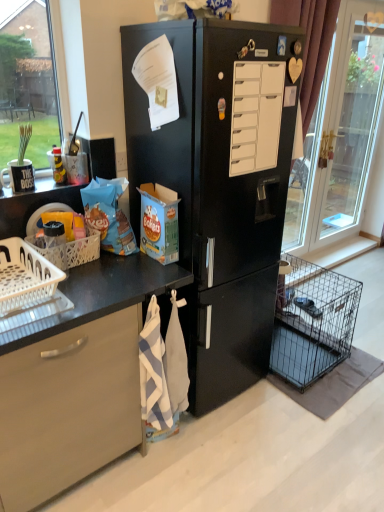
Question: Is black wire dog crate at lower right looking in the opposite direction of white striped towel at lower center?

Choices:
 (A) yes
 (B) no

Answer: (B)

Question: Is the position of black wire dog crate at lower right less distant than that of white striped towel at lower center?

Choices:
 (A) no
 (B) yes

Answer: (A)

Question: From the image's perspective, is black wire dog crate at lower right located beneath white striped towel at lower center?

Choices:
 (A) yes
 (B) no

Answer: (B)

Question: From a real-world perspective, is black wire dog crate at lower right positioned over white striped towel at lower center based on gravity?

Choices:
 (A) yes
 (B) no

Answer: (B)

Question: Does black wire dog crate at lower right come behind white striped towel at lower center?

Choices:
 (A) yes
 (B) no

Answer: (A)

Question: Is white matte drawer at center wider or thinner than black wire dog crate at lower right?

Choices:
 (A) wide
 (B) thin

Answer: (B)

Question: From a real-world perspective, is white matte drawer at center positioned above or below black wire dog crate at lower right?

Choices:
 (A) below
 (B) above

Answer: (B)

Question: From their relative heights in the image, would you say white matte drawer at center is taller or shorter than black wire dog crate at lower right?

Choices:
 (A) short
 (B) tall

Answer: (A)

Question: Is white matte drawer at center spatially inside black wire dog crate at lower right, or outside of it?

Choices:
 (A) inside
 (B) outside

Answer: (B)

Question: Is white plastic basket at left, which is counted as the 1th basket, starting from the front, spatially inside black wire dog crate at lower right, or outside of it?

Choices:
 (A) inside
 (B) outside

Answer: (B)

Question: Is point (16, 238) closer or farther from the camera than point (286, 289)?

Choices:
 (A) closer
 (B) farther

Answer: (A)

Question: From their relative heights in the image, would you say white plastic basket at left, the 2th basket when ordered from back to front, is taller or shorter than black wire dog crate at lower right?

Choices:
 (A) tall
 (B) short

Answer: (B)

Question: From the image's perspective, relative to black wire dog crate at lower right, is white plastic basket at left, which is counted as the 1th basket, starting from the front, above or below?

Choices:
 (A) above
 (B) below

Answer: (A)

Question: Is point (26, 239) closer or farther from the camera than point (185, 408)?

Choices:
 (A) closer
 (B) farther

Answer: (A)

Question: From the image's perspective, is white plastic basket at lower left, the 1th basket when ordered from back to front, above or below white striped towel at lower center?

Choices:
 (A) above
 (B) below

Answer: (A)